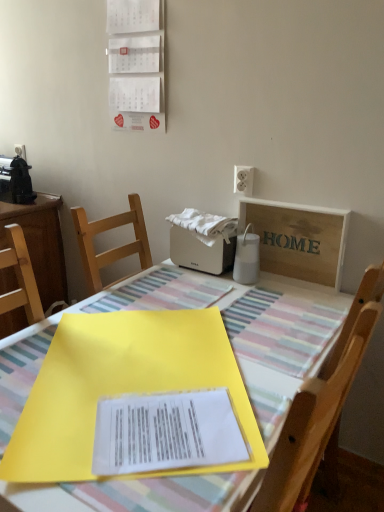
You are a GUI agent. You are given a task and a screenshot of the screen. Output one action in this format:
    pyautogui.click(x=<x>, y=<y>)
    Task: Click on the free space that is to the left of wooden sign at upper right
    
    Given the screenshot: What is the action you would take?
    pyautogui.click(x=236, y=290)